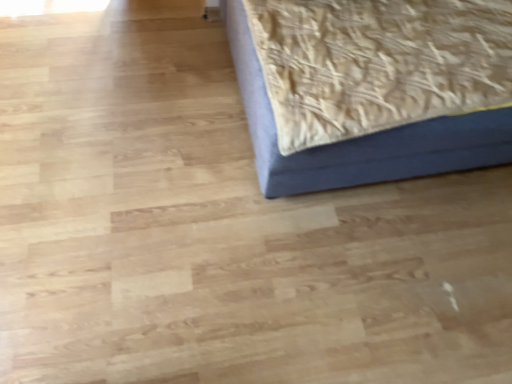
At what (x,y) coordinates should I click in order to perform the action: click on free location to the left of velvet blue bed at upper right. Please return your answer as a coordinate pair (x, y). Looking at the image, I should click on (119, 129).